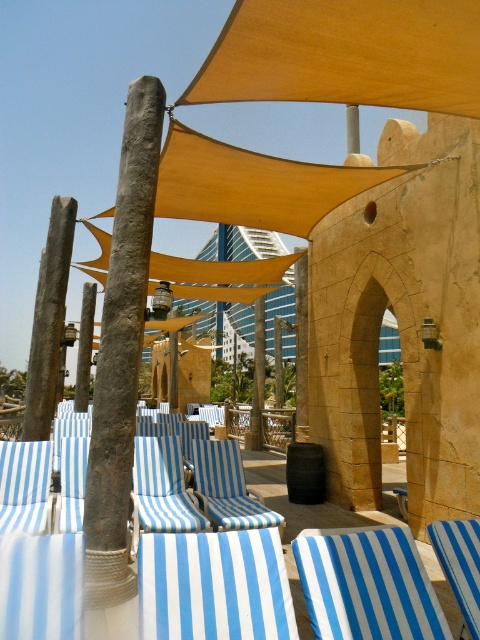
Question: Can you confirm if matte yellow fabric canopy at center is positioned below beige stone archway at center?

Choices:
 (A) yes
 (B) no

Answer: (B)

Question: Which object is farther from the camera taking this photo?

Choices:
 (A) blue striped fabric beach chair at left
 (B) rustic wood pole at center
 (C) blue striped fabric beach chair at lower center

Answer: (A)

Question: Can you confirm if rustic wood pole at center is bigger than beige stone archway at center?

Choices:
 (A) no
 (B) yes

Answer: (A)

Question: Is matte yellow fabric canopy at upper center to the right of blue striped fabric beach chair at lower right from the viewer's perspective?

Choices:
 (A) no
 (B) yes

Answer: (A)

Question: Which object is the closest to the beige stone archway at center?

Choices:
 (A) rusty metal pole at center
 (B) matte yellow fabric canopy at upper center
 (C) matte yellow fabric canopy at center
 (D) blue striped fabric beach chair at lower right

Answer: (C)

Question: Which point is farther to the camera?

Choices:
 (A) rusty metal pole at center
 (B) blue striped fabric beach chair at lower right
 (C) beige stone archway at center
 (D) rustic wood pole at center

Answer: (A)